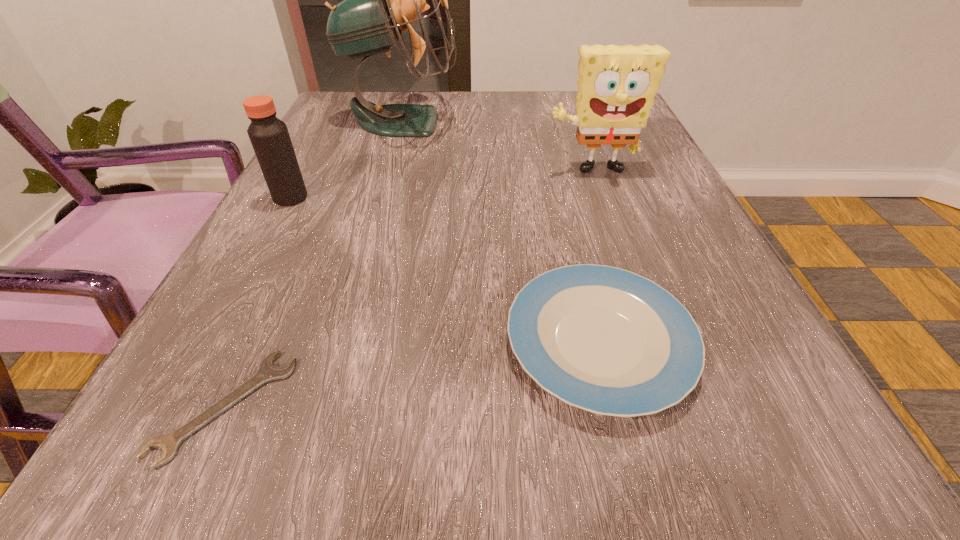
You are a GUI agent. You are given a task and a screenshot of the screen. Output one action in this format:
    pyautogui.click(x=<x>, y=<y>)
    Task: Click on the plate positioned at the right edge
    The image size is (960, 540).
    Given the screenshot: What is the action you would take?
    pyautogui.click(x=606, y=340)

At what (x,y) coordinates should I click in order to perform the action: click on object that is at the far left corner. Please return your answer as a coordinate pair (x, y). Looking at the image, I should click on pyautogui.click(x=380, y=0).

Identify the location of object that is at the near left corner. (170, 442).

Locate an element on the screen. The image size is (960, 540). object located at the near right corner is located at coordinates (606, 340).

The image size is (960, 540). Find the location of `vacant space at the far edge of the desktop`. vacant space at the far edge of the desktop is located at coordinates point(519,108).

Find the location of a particular element. free space at the near edge is located at coordinates (583, 481).

Locate an element on the screen. This screenshot has height=540, width=960. free region at the left edge is located at coordinates (258, 238).

Where is `free region at the right edge of the desktop`? The image size is (960, 540). free region at the right edge of the desktop is located at coordinates (707, 374).

You are a GUI agent. You are given a task and a screenshot of the screen. Output one action in this format:
    pyautogui.click(x=<x>, y=<y>)
    Task: Click on the unoccupied area between the wrench and the tallest object
    The width and height of the screenshot is (960, 540).
    Given the screenshot: What is the action you would take?
    pyautogui.click(x=314, y=264)

The height and width of the screenshot is (540, 960). Find the location of `vacant region between the shortest object and the tallest object`. vacant region between the shortest object and the tallest object is located at coordinates (314, 264).